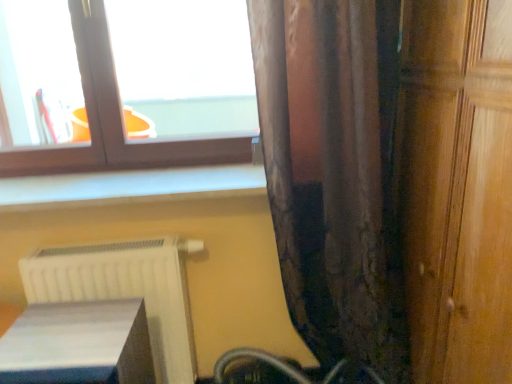
Question: Is point click(99, 321) positioned closer to the camera than point click(74, 99)?

Choices:
 (A) farther
 (B) closer

Answer: (B)

Question: Based on their sizes in the image, would you say white glossy book at lower left is bigger or smaller than matte brown window at upper left?

Choices:
 (A) small
 (B) big

Answer: (A)

Question: Considering the real-world distances, which object is closest to the matte brown window at upper left?

Choices:
 (A) white glossy book at lower left
 (B) brown textured curtain at right
 (C) white matte radiator at lower left
 (D) wooden door at right

Answer: (C)

Question: Which of these objects is positioned closest to the white glossy book at lower left?

Choices:
 (A) wooden door at right
 (B) matte brown window at upper left
 (C) white matte radiator at lower left
 (D) brown textured curtain at right

Answer: (C)